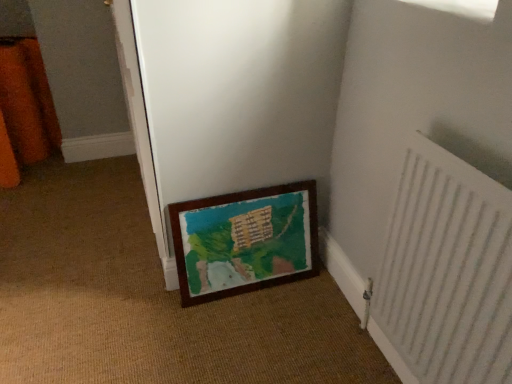
Locate an element on the screen. The height and width of the screenshot is (384, 512). free space to the left of wooden frame at lower center is located at coordinates (143, 298).